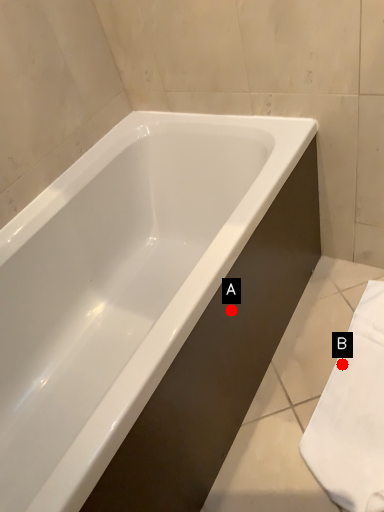
Question: Two points are circled on the image, labeled by A and B beside each circle. Which point is farther from the camera taking this photo?

Choices:
 (A) A is further
 (B) B is further

Answer: (B)